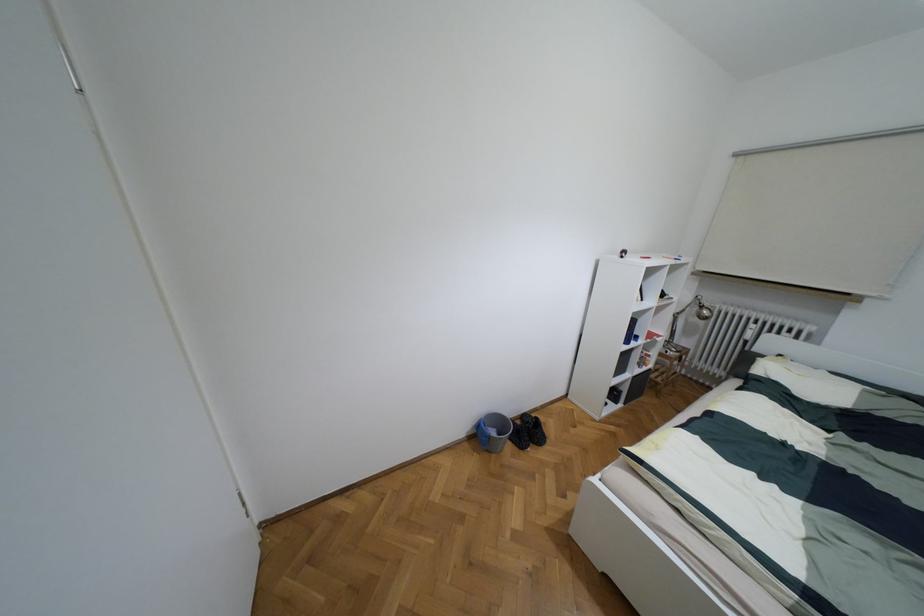
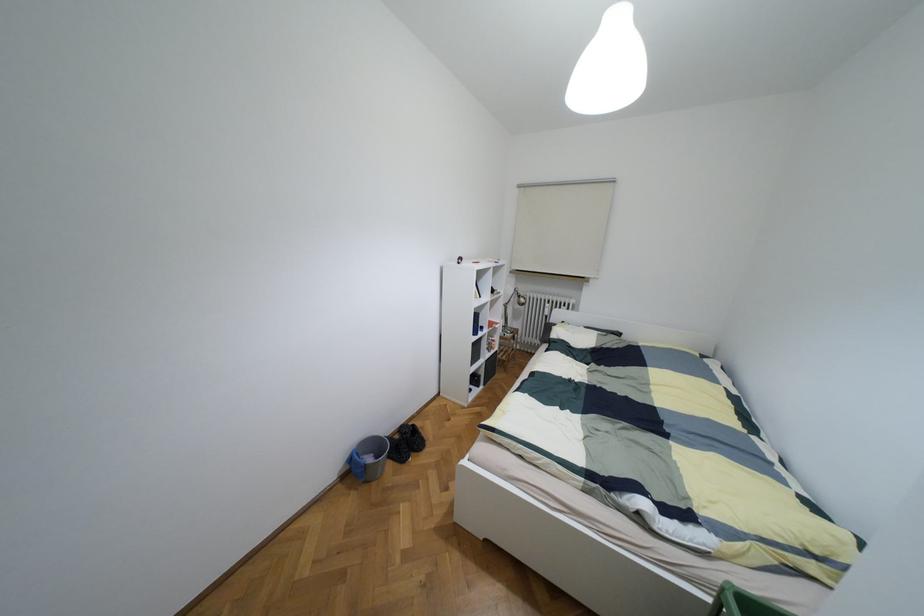
Locate, in the second image, the point that corresponds to point (517, 422) in the first image.

(395, 436)